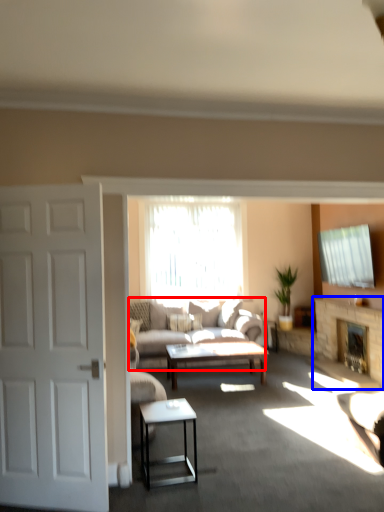
Question: Which of the following is the farthest to the observer, studio couch (highlighted by a red box) or fireplace (highlighted by a blue box)?

Choices:
 (A) studio couch
 (B) fireplace

Answer: (B)